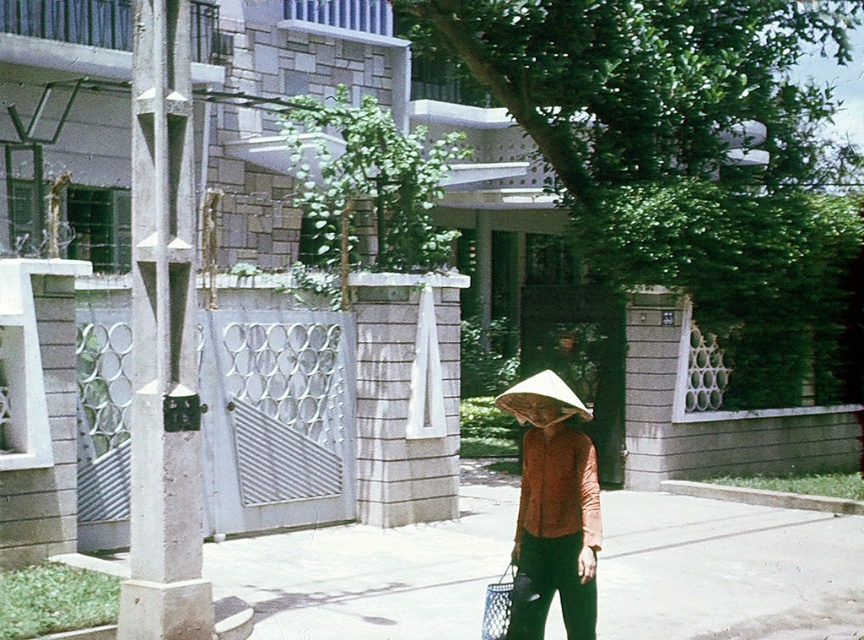
You are a delivery person trying to navigate to the address located behind the metal gate. You see the smooth concrete pavement at center and the white straw hat at center in your path. Which object is closer to the ground?

The smooth concrete pavement at center is closer to the ground because it is below the white straw hat at center.